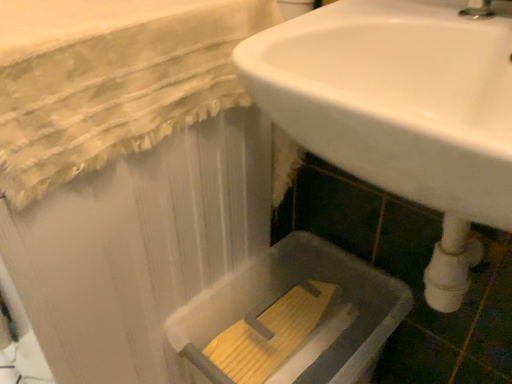
Question: Is translucent plastic bath at lower right inside or outside of white glossy sink at center?

Choices:
 (A) outside
 (B) inside

Answer: (A)

Question: In the image, is translucent plastic bath at lower right positioned in front of or behind white glossy sink at center?

Choices:
 (A) behind
 (B) front

Answer: (A)

Question: In the image, is translucent plastic bath at lower right on the left side or the right side of white glossy sink at center?

Choices:
 (A) right
 (B) left

Answer: (B)

Question: Considering the positions of point (261, 46) and point (357, 297), is point (261, 46) closer or farther from the camera than point (357, 297)?

Choices:
 (A) closer
 (B) farther

Answer: (A)

Question: Relative to translucent plastic bath at lower right, is white glossy sink at center in front or behind?

Choices:
 (A) front
 (B) behind

Answer: (A)

Question: In terms of size, does white glossy sink at center appear bigger or smaller than translucent plastic bath at lower right?

Choices:
 (A) small
 (B) big

Answer: (B)

Question: Considering the relative positions of white glossy sink at center and translucent plastic bath at lower right in the image provided, is white glossy sink at center to the left or to the right of translucent plastic bath at lower right?

Choices:
 (A) left
 (B) right

Answer: (B)